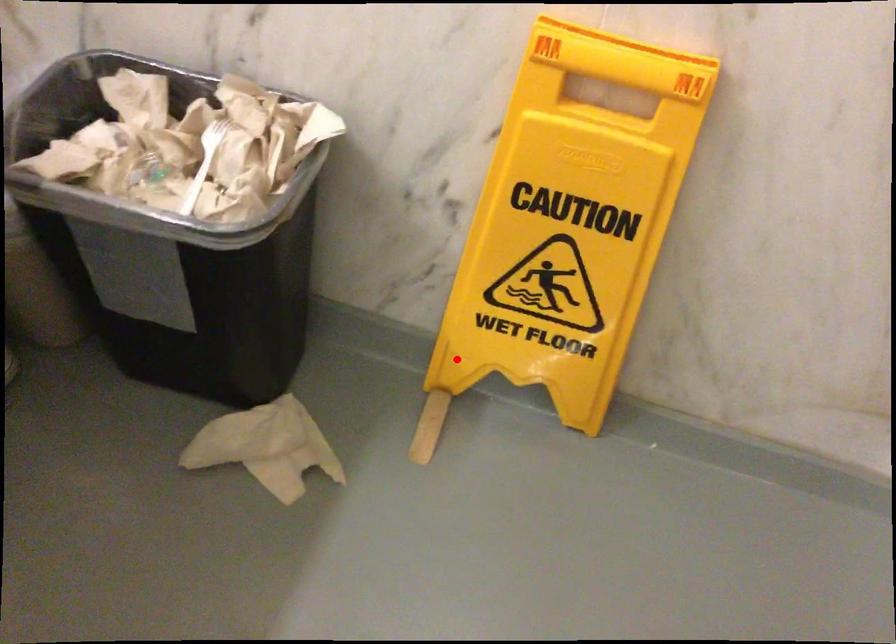
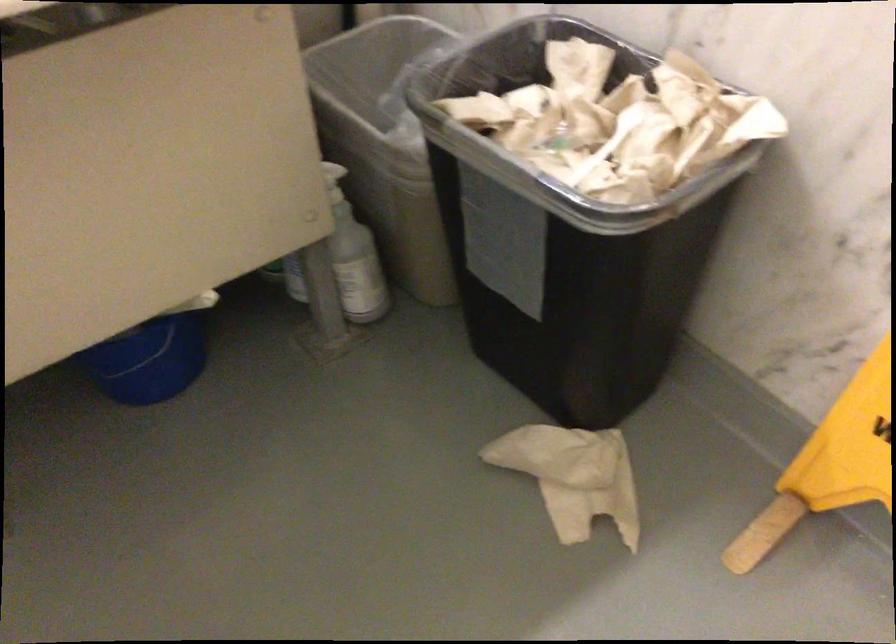
Where in the second image is the point corresponding to the highlighted location from the first image?

(830, 464)